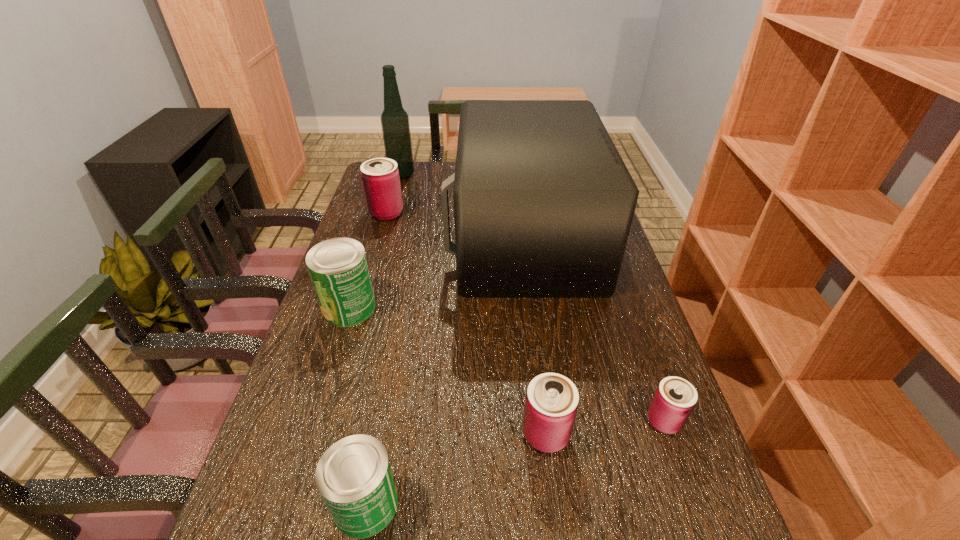
Identify the location of the tallest object. (395, 125).

Image resolution: width=960 pixels, height=540 pixels. What are the coordinates of `alcohol` in the screenshot? It's located at (395, 125).

Identify the location of microwave oven. The height and width of the screenshot is (540, 960). (543, 203).

What are the coordinates of `the biggest pink can` in the screenshot? It's located at (380, 177).

This screenshot has width=960, height=540. Find the location of `the farthest can`. the farthest can is located at coordinates (380, 177).

Where is `the fourth nearest can`? The width and height of the screenshot is (960, 540). the fourth nearest can is located at coordinates (338, 268).

Where is `the left green can`? the left green can is located at coordinates (338, 268).

This screenshot has height=540, width=960. What are the coordinates of `the second pink can from right to left` in the screenshot? It's located at (551, 404).

This screenshot has height=540, width=960. What are the coordinates of `the second can from right to left` in the screenshot? It's located at (551, 404).

At what (x,y) coordinates should I click in order to perform the action: click on the nearest can. Please return your answer as a coordinate pair (x, y). Image resolution: width=960 pixels, height=540 pixels. Looking at the image, I should click on 354,477.